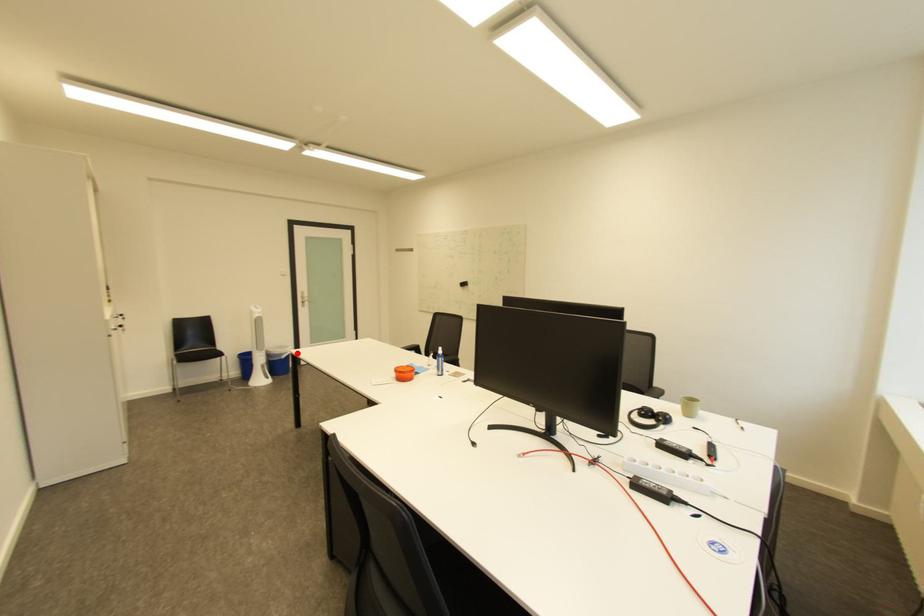
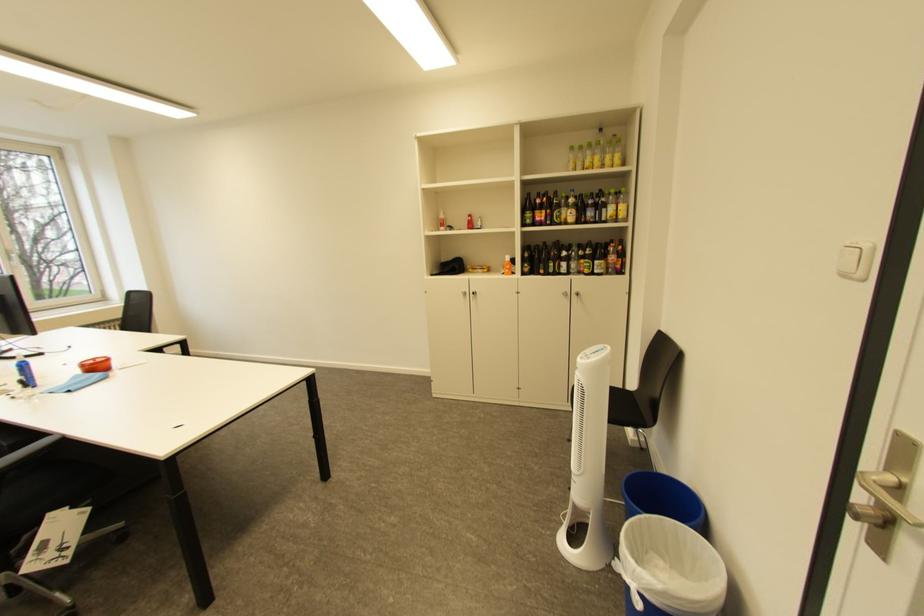
Question: A red point is marked in image1. In image2, is the corresponding 3D point closer to the camera or farther? Reply with the corresponding letter.

Choices:
 (A) The corresponding 3D point is closer.
 (B) The corresponding 3D point is farther.

Answer: (A)